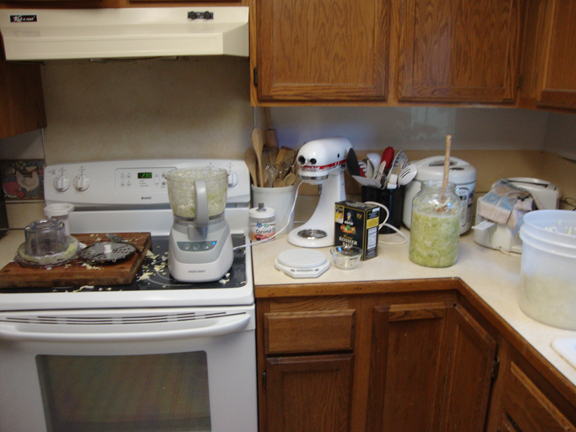
Locate an element on the screen. The image size is (576, 432). mason jar is located at coordinates (428, 203).